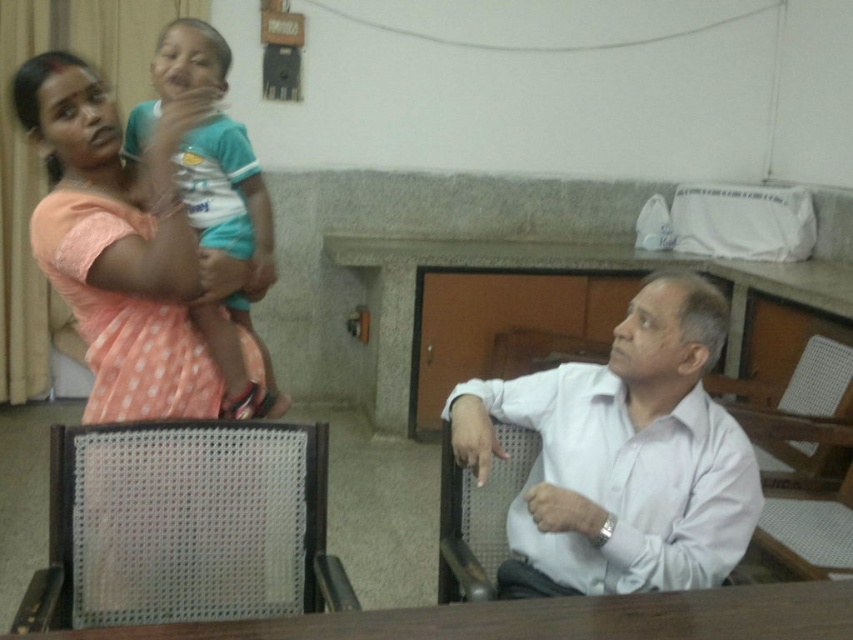
Is point (218, 593) positioned behind point (810, 440)?

That is False.

Does metal mesh chair at lower left appear on the left side of metal mesh chair at right?

Correct, you'll find metal mesh chair at lower left to the left of metal mesh chair at right.

The image size is (853, 640). I want to click on metal mesh chair at lower left, so click(184, 525).

Which of these two, teal jersey at upper left or metal mesh chair at right, stands taller?

teal jersey at upper left

Looking at this image, can you confirm if teal jersey at upper left is positioned to the left of metal mesh chair at right?

Indeed, teal jersey at upper left is positioned on the left side of metal mesh chair at right.

Between point (213, 332) and point (787, 476), which one is positioned behind?

The point (787, 476) is behind.

Find the location of a particular element. This screenshot has height=640, width=853. teal jersey at upper left is located at coordinates (227, 193).

Does white shirt at center come behind metal mesh chair at lower left?

Yes, white shirt at center is behind metal mesh chair at lower left.

Between point (608, 428) and point (148, 484), which one is positioned in front?

Point (148, 484) is in front.

You are a GUI agent. You are given a task and a screenshot of the screen. Output one action in this format:
    pyautogui.click(x=<x>, y=<y>)
    Task: Click on the white shirt at center
    Image resolution: width=853 pixels, height=640 pixels.
    Given the screenshot: What is the action you would take?
    pyautogui.click(x=622, y=456)

Find the location of a particular element. This screenshot has width=853, height=640. white shirt at center is located at coordinates tap(622, 456).